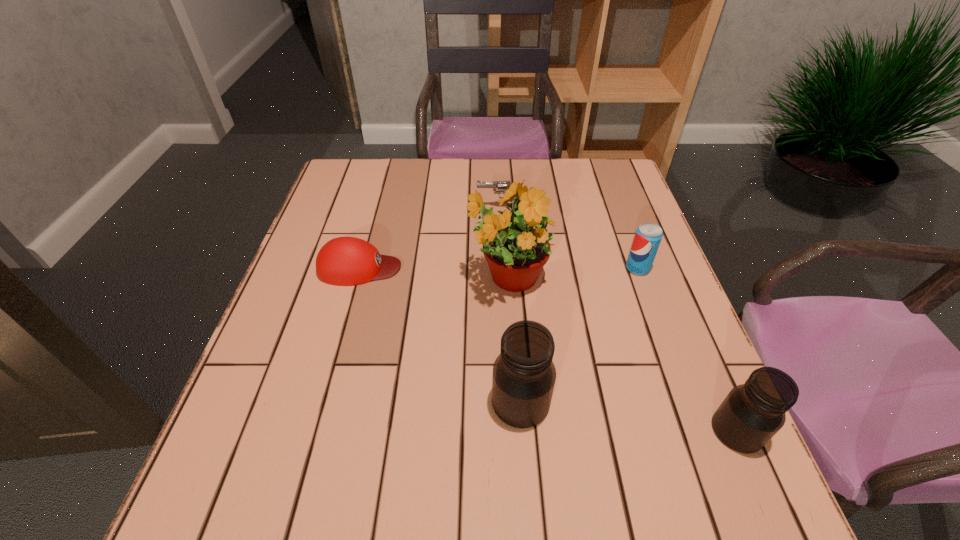
Where is `free location that satisfies the following two spatial constraints: 1. on the front-facing side of the baseball cap; 2. on the right side of the soda can`? Image resolution: width=960 pixels, height=540 pixels. free location that satisfies the following two spatial constraints: 1. on the front-facing side of the baseball cap; 2. on the right side of the soda can is located at coordinates (360, 268).

The image size is (960, 540). I want to click on vacant space that satisfies the following two spatial constraints: 1. at the barrel of the farthest object; 2. on the right side of the fifth shortest object, so point(513,402).

The height and width of the screenshot is (540, 960). In order to click on vacant point that satisfies the following two spatial constraints: 1. at the barrel of the fifth shortest object; 2. on the right side of the pistol in this screenshot , I will do `click(513, 402)`.

I want to click on blank space that satisfies the following two spatial constraints: 1. at the barrel of the taller jar; 2. on the right side of the farthest object, so click(x=513, y=402).

Image resolution: width=960 pixels, height=540 pixels. Find the location of `vacant space that satisfies the following two spatial constraints: 1. on the front-facing side of the baseball cap; 2. on the left side of the right jar`. vacant space that satisfies the following two spatial constraints: 1. on the front-facing side of the baseball cap; 2. on the left side of the right jar is located at coordinates (314, 430).

The image size is (960, 540). Identify the location of free point that satisfies the following two spatial constraints: 1. on the front-facing side of the left jar; 2. on the right side of the baseball cap. (323, 402).

This screenshot has height=540, width=960. Identify the location of free space that satisfies the following two spatial constraints: 1. at the barrel of the taller jar; 2. on the right side of the farthest object. (513, 402).

The image size is (960, 540). In order to click on vacant space that satisfies the following two spatial constraints: 1. at the barrel of the farthest object; 2. on the left side of the flowerpot in this screenshot , I will do `click(505, 279)`.